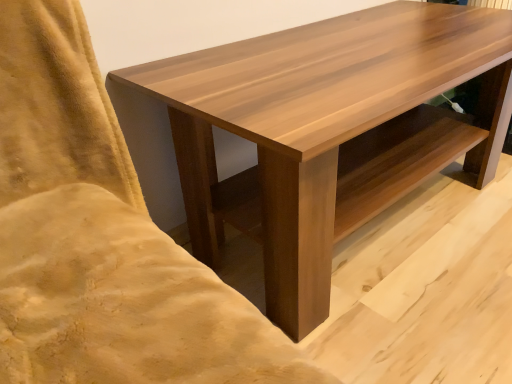
At what (x,y) coordinates should I click in order to perform the action: click on free spot above satin wood table at center (from a real-world perspective). Please return your answer as a coordinate pair (x, y). The height and width of the screenshot is (384, 512). Looking at the image, I should click on (327, 55).